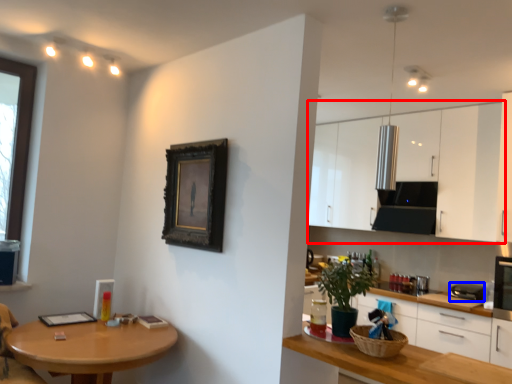
Question: Which object appears closest to the camera in this image, cabinetry (highlighted by a red box) or appliance (highlighted by a blue box)?

Choices:
 (A) cabinetry
 (B) appliance

Answer: (B)